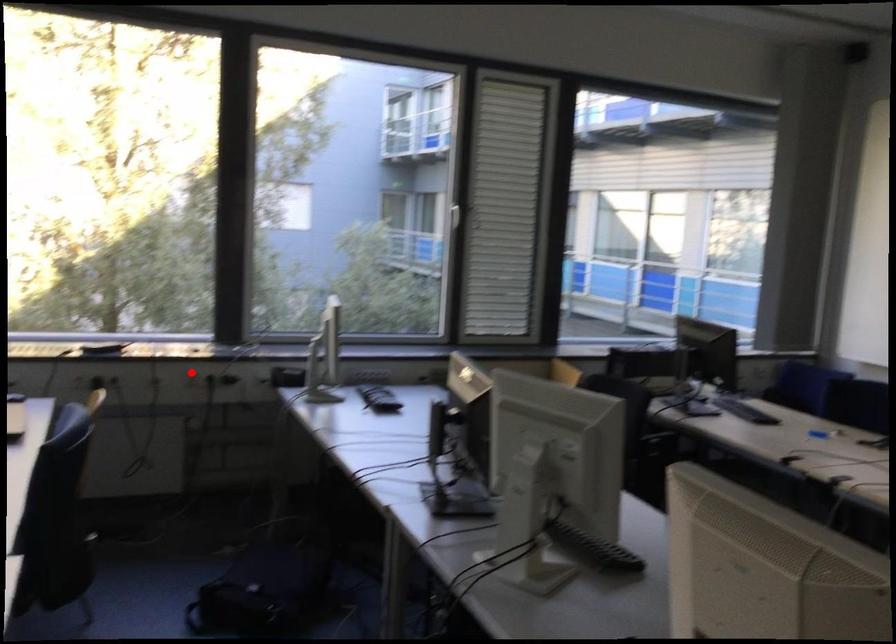
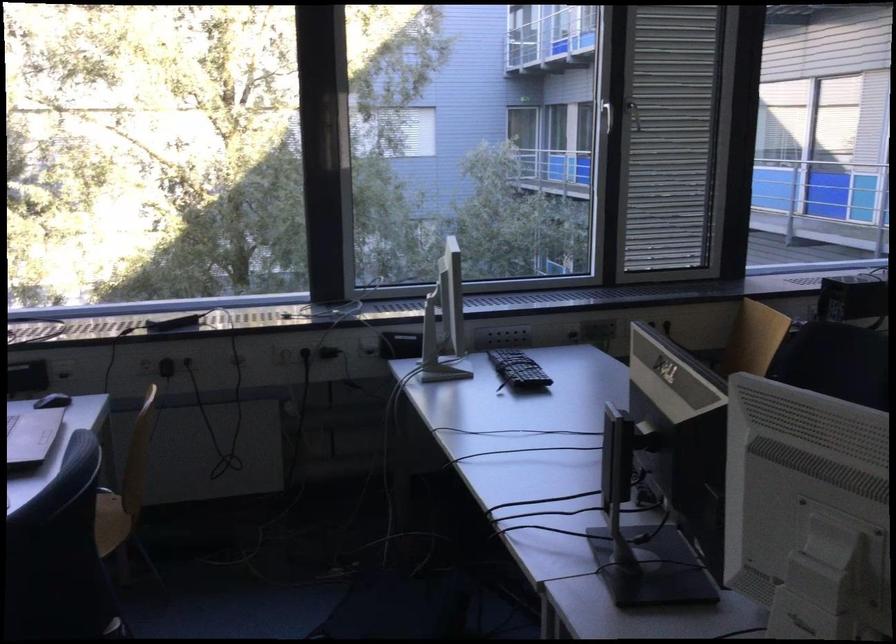
Question: I am providing you with two images of the same scene from different viewpoints. Given a red point in image1, look at the same physical point in image2. Is it:

Choices:
 (A) Closer to the viewpoint
 (B) Farther from the viewpoint

Answer: (A)